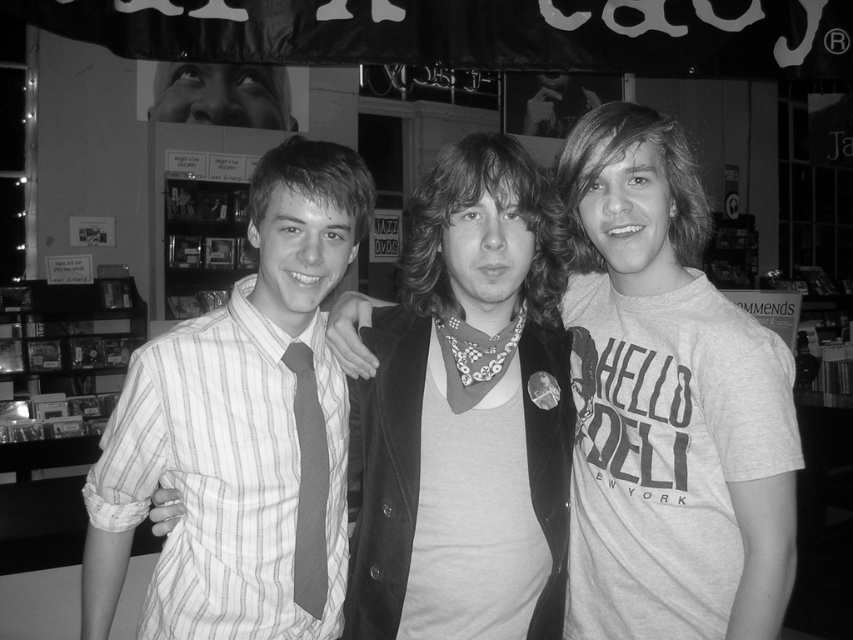
Does matte black jacket at center have a greater height compared to striped cotton shirt at center?

Correct, matte black jacket at center is much taller as striped cotton shirt at center.

Is matte black jacket at center further to camera compared to striped cotton shirt at center?

No, it is in front of striped cotton shirt at center.

Image resolution: width=853 pixels, height=640 pixels. In order to click on matte black jacket at center in this screenshot , I will do `click(668, 404)`.

At what (x,y) coordinates should I click in order to perform the action: click on matte black jacket at center. Please return your answer as a coordinate pair (x, y). The image size is (853, 640). Looking at the image, I should click on 668,404.

Between point (119, 432) and point (325, 508), which one is positioned in front?

Point (119, 432)

Which is below, striped cotton shirt at center or striped fabric tie at center?

striped fabric tie at center

You are a GUI agent. You are given a task and a screenshot of the screen. Output one action in this format:
    pyautogui.click(x=<x>, y=<y>)
    Task: Click on the striped cotton shirt at center
    The width and height of the screenshot is (853, 640).
    Given the screenshot: What is the action you would take?
    pyautogui.click(x=241, y=432)

Is point (676, 257) in front of point (312, 387)?

No.

Which is in front, point (743, 483) or point (322, 465)?

Point (743, 483)

The width and height of the screenshot is (853, 640). I want to click on matte black jacket at center, so click(668, 404).